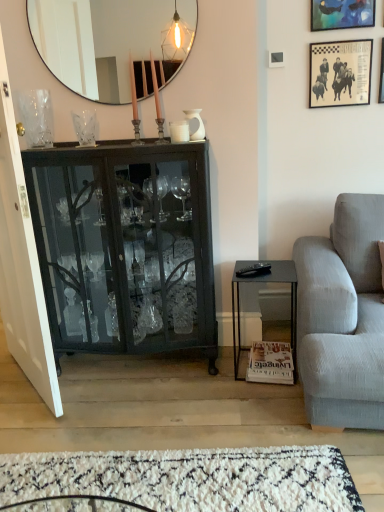
Question: From a real-world perspective, is white matte coffee cup at center positioned above or below light gray fabric couch at right?

Choices:
 (A) below
 (B) above

Answer: (B)

Question: From their relative heights in the image, would you say white matte coffee cup at center is taller or shorter than light gray fabric couch at right?

Choices:
 (A) tall
 (B) short

Answer: (B)

Question: Considering the real-world distances, which object is farthest from the metallic silver picture frame at upper right, the third picture frame viewed from the left?

Choices:
 (A) clear glass vase at upper left, which is the 1th vase in left-to-right order
 (B) white glossy vase at upper center, which ranks as the 3th vase in left-to-right order
 (C) clear glass vase at upper center, acting as the second vase starting from the left
 (D) light gray fabric couch at right
 (E) white shag rug at lower center

Answer: (E)

Question: Which object is positioned farthest from the white shag rug at lower center?

Choices:
 (A) matte black mirror at upper center
 (B) white glossy vase at upper center, which ranks as the 1th vase in right-to-left order
 (C) clear glass vase at upper center, acting as the second vase starting from the left
 (D) black glass cabinet at left
 (E) clear glass vase at upper left, placed as the third vase when sorted from right to left

Answer: (A)